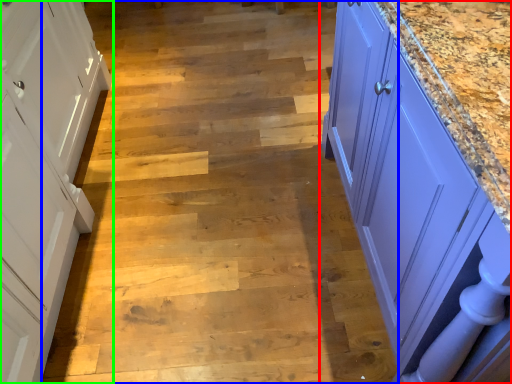
Question: Estimate the real-world distances between objects in this image. Which object is farther from countertop (highlighted by a red box), stair (highlighted by a blue box) or cabinetry (highlighted by a green box)?

Choices:
 (A) stair
 (B) cabinetry

Answer: (B)